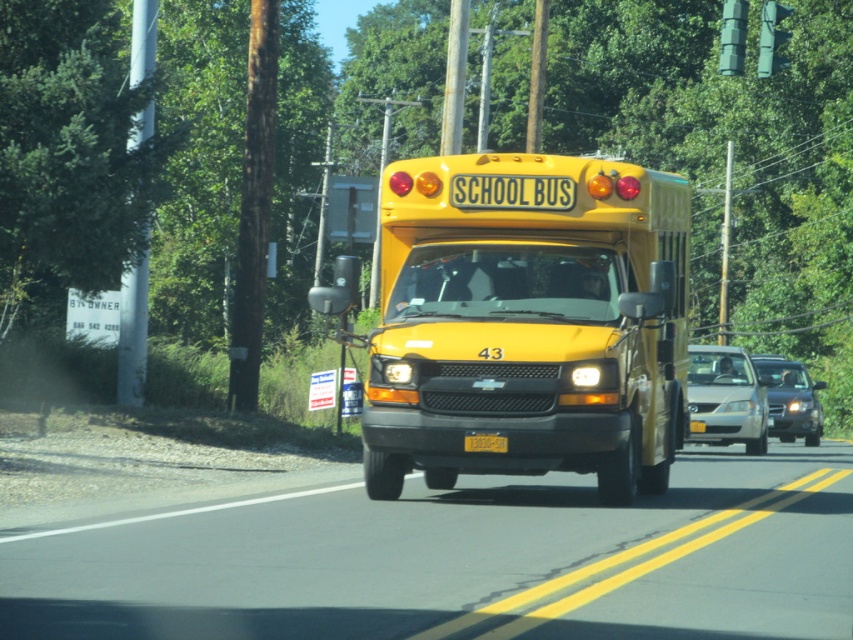
You are a photographer trying to capture the yellow matte school bus at center and the yellow matte license plate at center in a single shot. Since you want to ensure both are clearly visible, which object should you focus on first to account for their sizes?

The yellow matte school bus at center is taller than the yellow matte license plate at center, so you should focus on the yellow matte school bus at center first to ensure its details are sharp before adjusting for the smaller license plate.

Consider the image. You are a driver approaching the yellow school bus on a road with a double yellow line. You see a silver metallic sedan at center and a shiny black sedan at center. Which sedan is closer to the left side of the road?

The silver metallic sedan at center is positioned on the left side of the shiny black sedan at center, so it is closer to the left side of the road.

You are a delivery driver who needs to park your truck, which is 2 meters tall, behind the yellow matte school bus at center and the silver metallic sedan at center. Can you safely park your truck without hitting the roof? Please explain your reasoning based on the vehicles in the image.

The yellow matte school bus at center has a greater height compared to the silver metallic sedan at center. Since the school bus is taller, if the truck is 2 meters tall, it depends on the school bus height. However, without specific measurements, we can infer that school buses are typically around 3.5 meters tall, which is taller than the truck. Therefore, parking behind the school bus might not be safe. The sedan is shorter, so parking behind it could be safer if there is space.